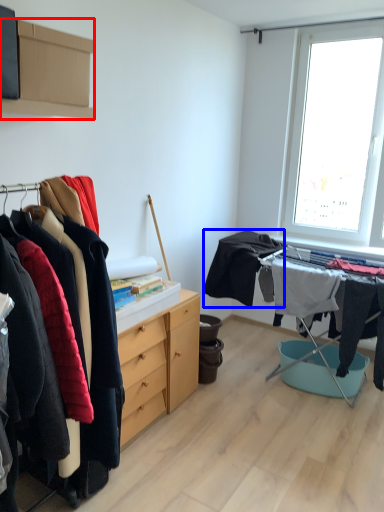
Question: Which point is closer to the camera, cabinetry (highlighted by a red box) or clothing (highlighted by a blue box)?

Choices:
 (A) cabinetry
 (B) clothing

Answer: (A)